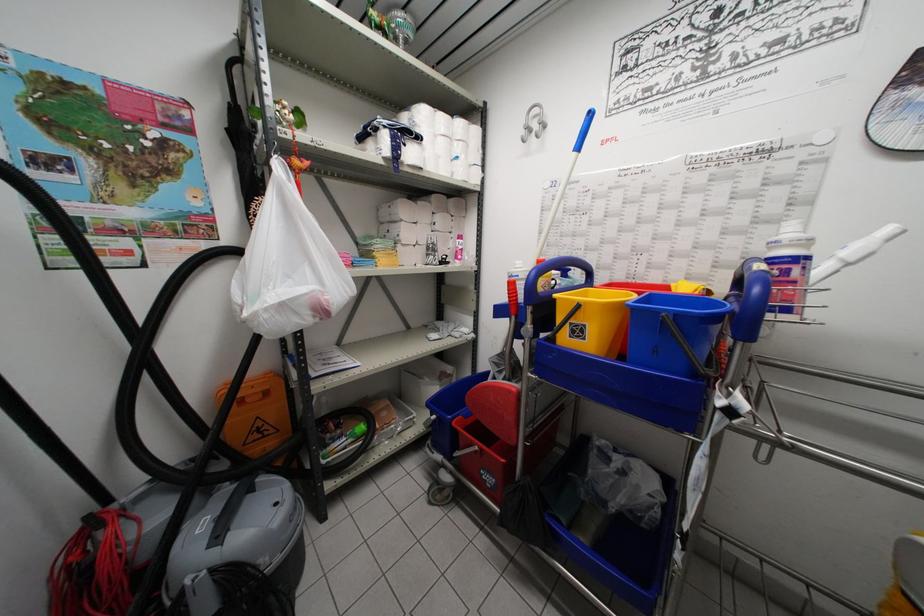
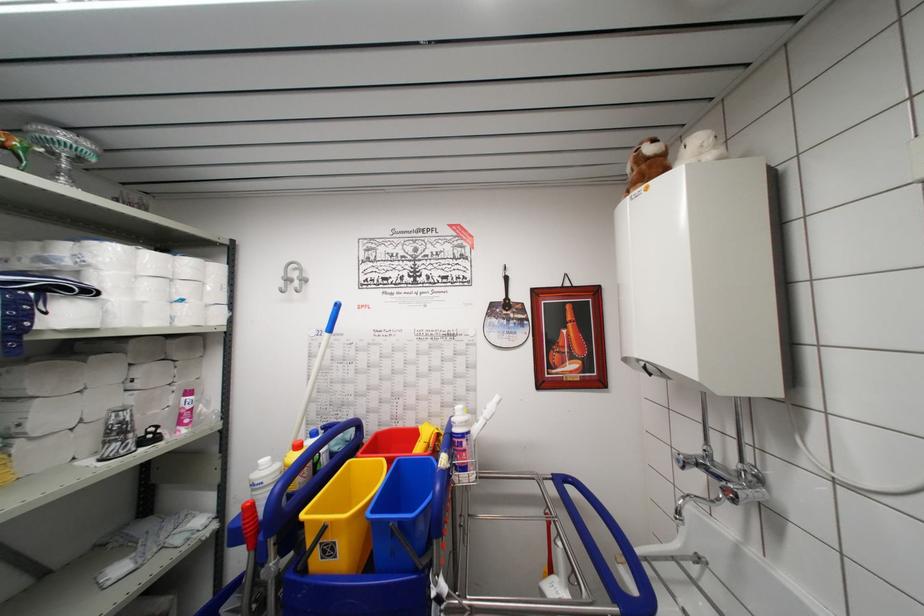
In the second image, find the point that corresponds to point (456, 225) in the first image.

(178, 371)